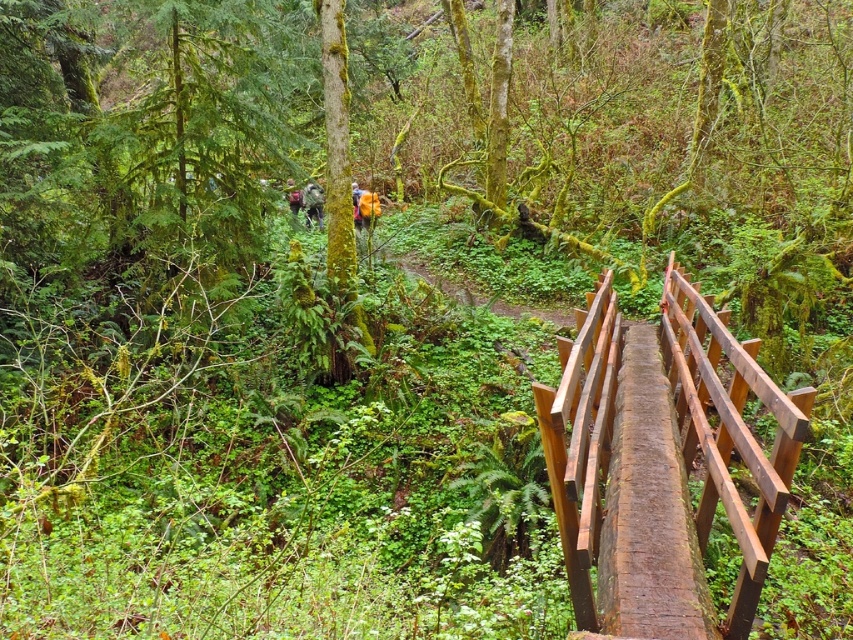
You are a hiker who wants to carry both the camouflage fabric backpack at center and the camouflage backpack at center. Which one can hold more items?

The camouflage fabric backpack at center is larger in size than the camouflage backpack at center, so it can hold more items.

You are hiking and carrying a camouflage fabric backpack at center. You notice a brown wooden rail at upper right. Is the rail located above or below your backpack?

The brown wooden rail at upper right is positioned under the camouflage fabric backpack at center, so the rail is below your backpack.